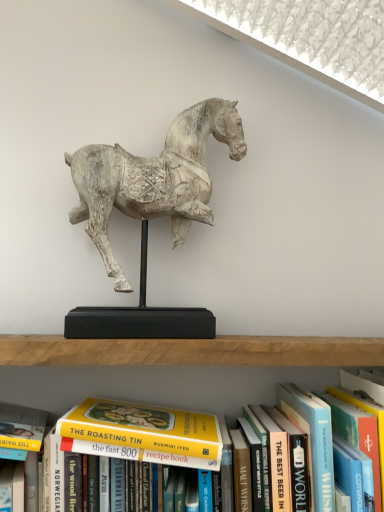
Question: In terms of width, does hardcover book at center, which is counted as the first paperback book, starting from the left, look wider or thinner when compared to hardcover book at center, the 1th paperback book viewed from the right?

Choices:
 (A) thin
 (B) wide

Answer: (A)

Question: In the image, is hardcover book at center, which is counted as the first paperback book, starting from the left, on the left side or the right side of hardcover book at center, arranged as the 2th paperback book when viewed from the left?

Choices:
 (A) right
 (B) left

Answer: (B)

Question: Considering the real-world distances, which object is closest to the hardcover book at center, the 1th paperback book viewed from the right?

Choices:
 (A) white wood horse at center
 (B) yellow paperback book at center
 (C) hardcover book at center, acting as the 2th paperback book starting from the right

Answer: (C)

Question: Which of these objects is positioned farthest from the white wood horse at center?

Choices:
 (A) hardcover book at center, the 1th paperback book viewed from the right
 (B) hardcover book at center, acting as the 2th paperback book starting from the right
 (C) yellow paperback book at center

Answer: (A)